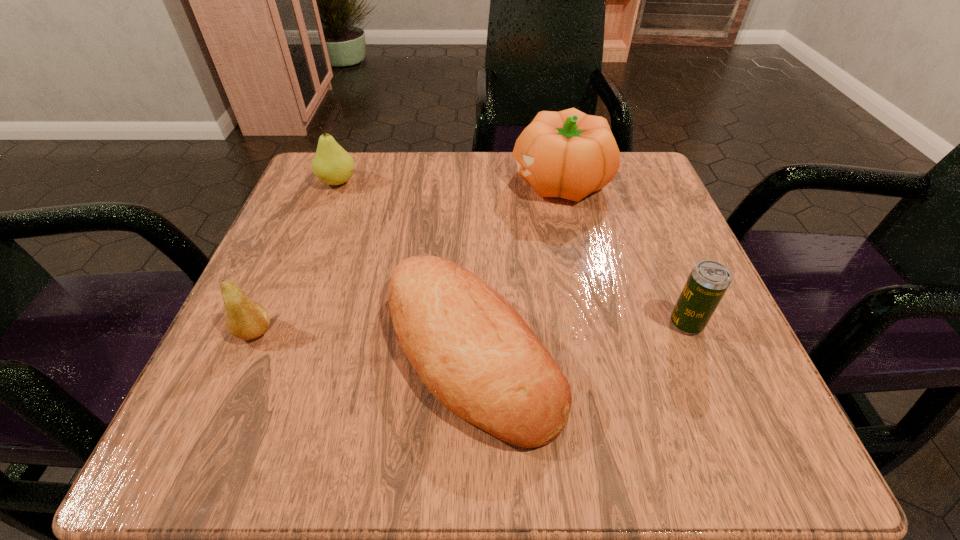
At what (x,y) coordinates should I click in order to perform the action: click on vacant space situated 0.250m on the right of the shorter pear. Please return your answer as a coordinate pair (x, y). This screenshot has width=960, height=540. Looking at the image, I should click on (444, 332).

Image resolution: width=960 pixels, height=540 pixels. What are the coordinates of `free spot located on the back of the bread` in the screenshot? It's located at (473, 244).

Locate an element on the screen. pumpkin at the far edge is located at coordinates (568, 154).

Where is `pear situated at the far edge`? This screenshot has width=960, height=540. pear situated at the far edge is located at coordinates (331, 164).

Image resolution: width=960 pixels, height=540 pixels. Identify the location of object that is at the near edge. (473, 351).

Find the location of a particular element. pumpkin located at the right edge is located at coordinates 568,154.

The height and width of the screenshot is (540, 960). What are the coordinates of `beer can that is positioned at the right edge` in the screenshot? It's located at (708, 281).

The height and width of the screenshot is (540, 960). Find the location of `object at the far left corner`. object at the far left corner is located at coordinates (331, 164).

I want to click on object positioned at the far right corner, so click(568, 154).

This screenshot has width=960, height=540. Identify the location of free location at the far edge. (442, 199).